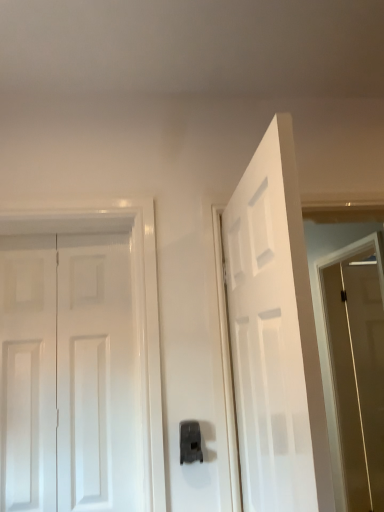
Question: Considering the positions of white glossy door at left, arranged as the 1th door when viewed from the left, and black plastic door handle at center in the image, is white glossy door at left, arranged as the 1th door when viewed from the left, bigger or smaller than black plastic door handle at center?

Choices:
 (A) big
 (B) small

Answer: (A)

Question: In terms of height, does white glossy door at left, arranged as the 1th door when viewed from the left, look taller or shorter compared to black plastic door handle at center?

Choices:
 (A) tall
 (B) short

Answer: (A)

Question: Which is farther from the black plastic door handle at center?

Choices:
 (A) white matte door at center, arranged as the 1th door when viewed from the right
 (B) brown matte screen door at right
 (C) white glossy door at left, which ranks as the 2th door in right-to-left order

Answer: (B)

Question: Considering the real-world distances, which object is closest to the black plastic door handle at center?

Choices:
 (A) brown matte screen door at right
 (B) white matte door at center, the 2th door when ordered from left to right
 (C) white glossy door at left, arranged as the 1th door when viewed from the left

Answer: (C)